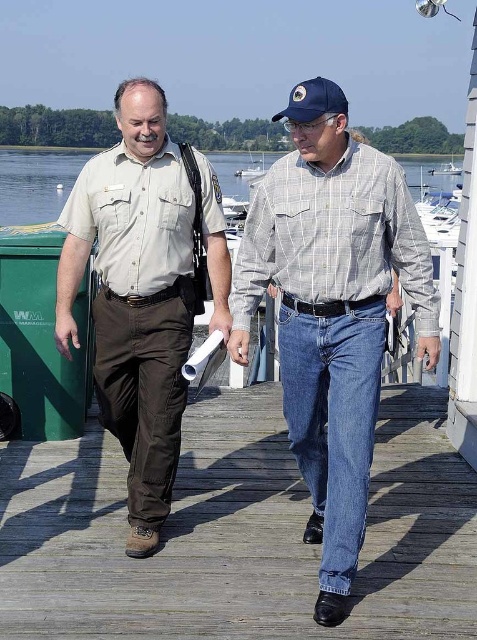
Question: Which of the following is the closest to the observer?

Choices:
 (A) (299, 128)
 (B) (178, 508)
 (C) (117, 100)
 (D) (237, 156)

Answer: (A)

Question: Observing the image, what is the correct spatial positioning of khaki uniform shirt at center in reference to white plastic boat at center?

Choices:
 (A) right
 (B) left

Answer: (B)

Question: Observing the image, what is the correct spatial positioning of wooden at center in reference to clear water at center?

Choices:
 (A) below
 (B) above

Answer: (A)

Question: Which point is farther from the camera taking this photo?

Choices:
 (A) (261, 164)
 (B) (450, 173)
 (C) (462, 499)

Answer: (B)

Question: Which point is farther to the camera?

Choices:
 (A) (290, 93)
 (B) (452, 161)
 (C) (127, 348)
 (D) (259, 163)

Answer: (B)

Question: Does clear water at center appear on the right side of white plastic boat at center?

Choices:
 (A) yes
 (B) no

Answer: (B)